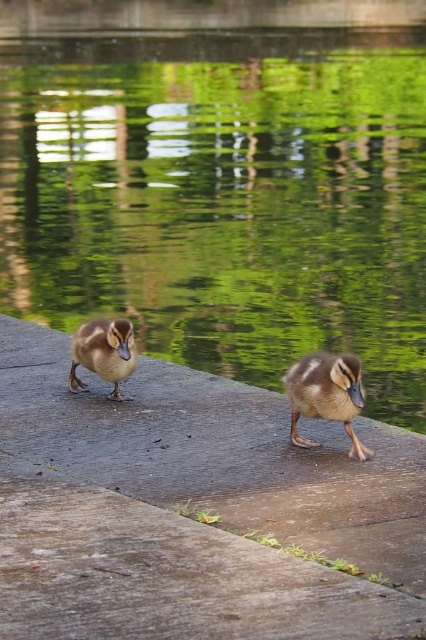
You are a photographer trying to capture both ducklings in a single shot. The ducklings are at point (316, 176) and point (417, 547). Based on their positions, which duckling is closer to the front of the image?

Point (316, 176) is behind point (417, 547), so the duckling at point (417, 547) is closer to the front of the image.

You are a photographer trying to capture both the brown matte duckling at center and the brown fuzzy duckling at center in a single shot. Since they are moving in opposite directions, you need to know which duckling is closer to the camera to adjust your focus. Based on the scene description, which duckling is positioned closer to the camera?

The brown matte duckling at center is positioned under the brown fuzzy duckling at center, so the brown matte duckling at center is closer to the camera.

You are a photographer trying to capture the brown fuzzy duckling at center in your shot. The green reflective water at center is in the background. Since the water is larger in size, will it cover the duckling in the photo?

The green reflective water at center is larger than the brown fuzzy duckling at center, so it might cover the duckling if the camera is focused on the water. To ensure the duckling is visible, adjust the focus to the foreground where the duckling is located.